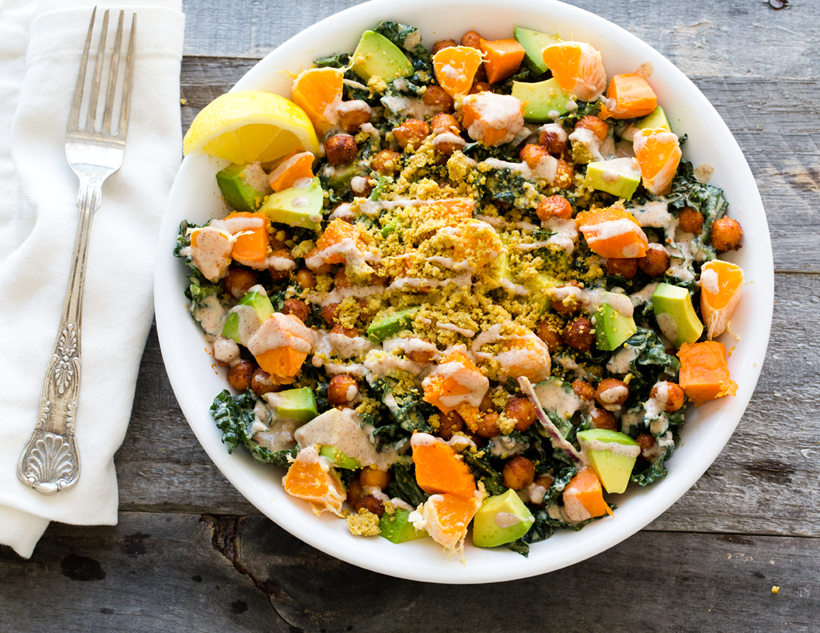
Locate an element on the screen. Image resolution: width=820 pixels, height=633 pixels. handle is located at coordinates (53, 444).